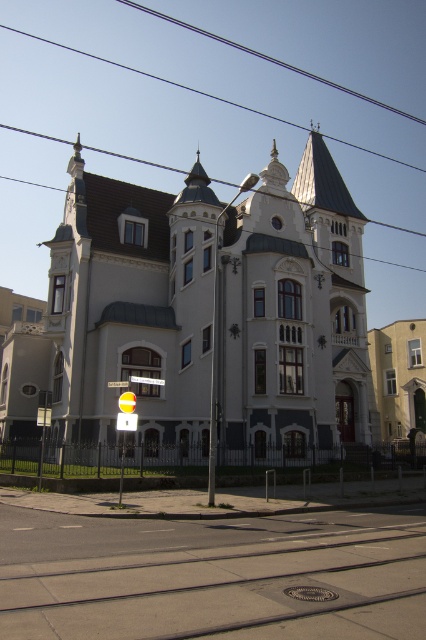
Can you confirm if metallic wire at upper center is wider than white plastic street sign at center?

Yes, metallic wire at upper center is wider than white plastic street sign at center.

Does metallic wire at upper center have a lesser width compared to white plastic street sign at center?

Incorrect, metallic wire at upper center's width is not less than white plastic street sign at center's.

In order to click on metallic wire at upper center in this screenshot , I will do `click(132, 157)`.

Can you confirm if white plastic street sign at center is smaller than white plastic street sign at upper center?

Correct, white plastic street sign at center occupies less space than white plastic street sign at upper center.

Who is taller, white plastic street sign at center or white plastic street sign at upper center?

white plastic street sign at upper center

Where is `white plastic street sign at center`? This screenshot has height=640, width=426. white plastic street sign at center is located at coordinates (146, 380).

Locate an element on the screen. white plastic street sign at center is located at coordinates (146, 380).

Is metallic wire at upper center positioned before white plastic street sign at upper center?

No.

Does point (11, 177) come closer to viewer compared to point (120, 381)?

No.

Between point (420, 232) and point (123, 387), which one is positioned in front?

Point (123, 387)

Identify the location of metallic wire at upper center. (132, 157).